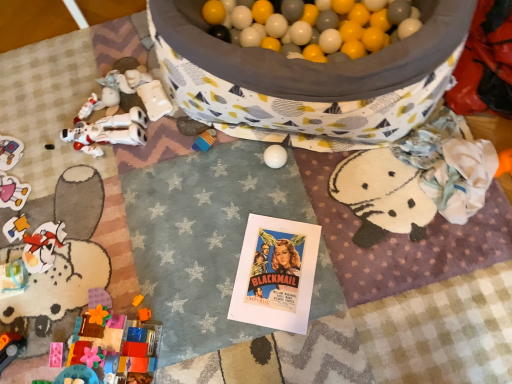
Identify the location of free region on the left part of white matte robot at left, which is the first toy in top-to-bottom order. The height and width of the screenshot is (384, 512). (38, 140).